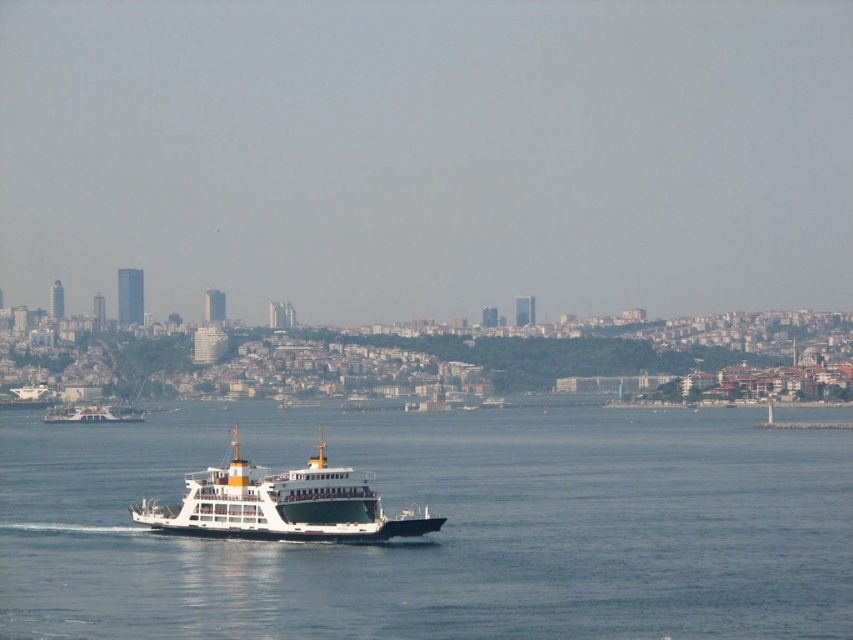
Between blue water at center and white matte ferry at center, which one has more height?

Standing taller between the two is blue water at center.

Does point (56, 612) come behind point (344, 513)?

That is True.

Does point (424, 547) come behind point (236, 438)?

No, it is in front of (236, 438).

I want to click on blue water at center, so click(442, 528).